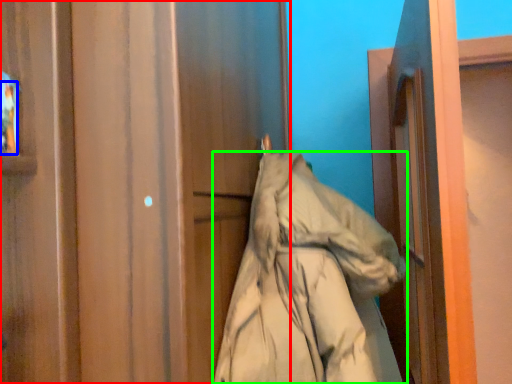
Question: Which is nearer to the door (highlighted by a red box)? person (highlighted by a blue box) or coat (highlighted by a green box).

Choices:
 (A) person
 (B) coat

Answer: (B)